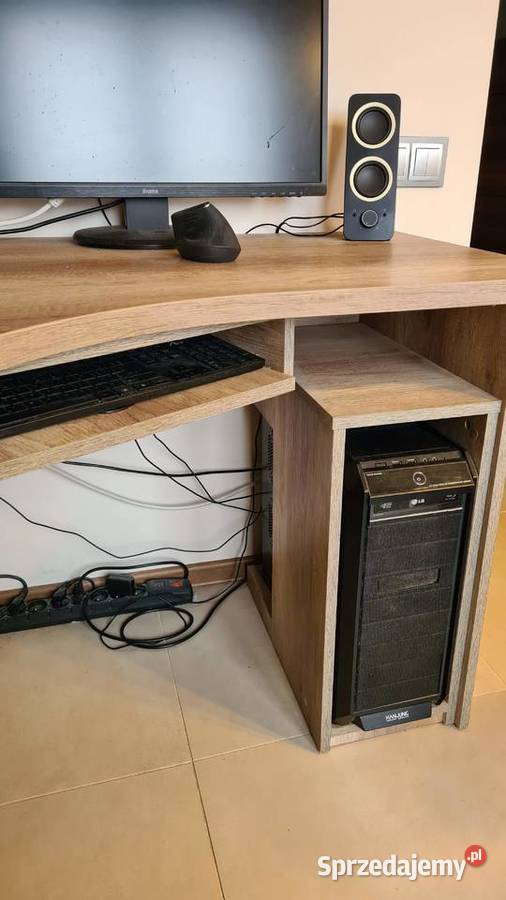
Find the location of a particular element. This screenshot has width=506, height=900. wood baseboard is located at coordinates (208, 571).